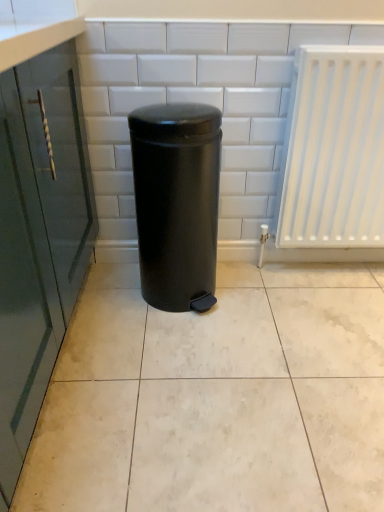
Question: Is white glossy ceramic tile at center looking in the opposite direction of white plastic radiator at right?

Choices:
 (A) yes
 (B) no

Answer: (B)

Question: Is white glossy ceramic tile at center not inside white plastic radiator at right?

Choices:
 (A) no
 (B) yes

Answer: (B)

Question: Can you confirm if white glossy ceramic tile at center is bigger than white plastic radiator at right?

Choices:
 (A) yes
 (B) no

Answer: (A)

Question: Is white glossy ceramic tile at center shorter than white plastic radiator at right?

Choices:
 (A) yes
 (B) no

Answer: (A)

Question: Is white glossy ceramic tile at center smaller than white plastic radiator at right?

Choices:
 (A) no
 (B) yes

Answer: (A)

Question: From the image's perspective, is white plastic radiator at right located above or below white glossy ceramic tile at center?

Choices:
 (A) below
 (B) above

Answer: (B)

Question: Is white plastic radiator at right to the left or to the right of white glossy ceramic tile at center in the image?

Choices:
 (A) left
 (B) right

Answer: (B)

Question: Is white plastic radiator at right situated inside white glossy ceramic tile at center or outside?

Choices:
 (A) inside
 (B) outside

Answer: (B)

Question: From their relative heights in the image, would you say white plastic radiator at right is taller or shorter than white glossy ceramic tile at center?

Choices:
 (A) short
 (B) tall

Answer: (B)

Question: Is point (200, 458) positioned closer to the camera than point (299, 72)?

Choices:
 (A) farther
 (B) closer

Answer: (B)

Question: Considering the positions of white glossy ceramic tile at center and white plastic radiator at right in the image, is white glossy ceramic tile at center bigger or smaller than white plastic radiator at right?

Choices:
 (A) big
 (B) small

Answer: (A)

Question: Considering the positions of white glossy ceramic tile at center and white plastic radiator at right in the image, is white glossy ceramic tile at center wider or thinner than white plastic radiator at right?

Choices:
 (A) wide
 (B) thin

Answer: (A)

Question: From a real-world perspective, is white glossy ceramic tile at center positioned above or below white plastic radiator at right?

Choices:
 (A) below
 (B) above

Answer: (A)

Question: Is black matte waste container at center wider or thinner than white plastic radiator at right?

Choices:
 (A) thin
 (B) wide

Answer: (B)

Question: From the image's perspective, is black matte waste container at center located above or below white plastic radiator at right?

Choices:
 (A) below
 (B) above

Answer: (A)